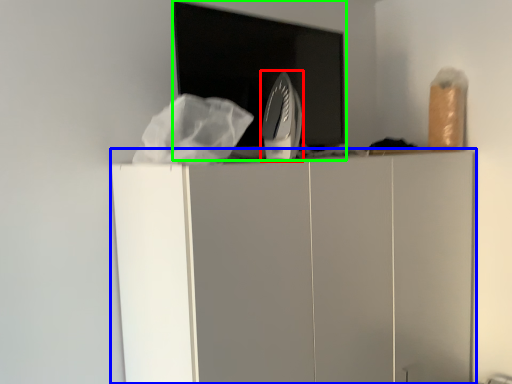
Question: Which object is positioned closest to home appliance (highlighted by a red box)? Select from furniture (highlighted by a blue box) and appliance (highlighted by a green box).

Choices:
 (A) furniture
 (B) appliance

Answer: (B)